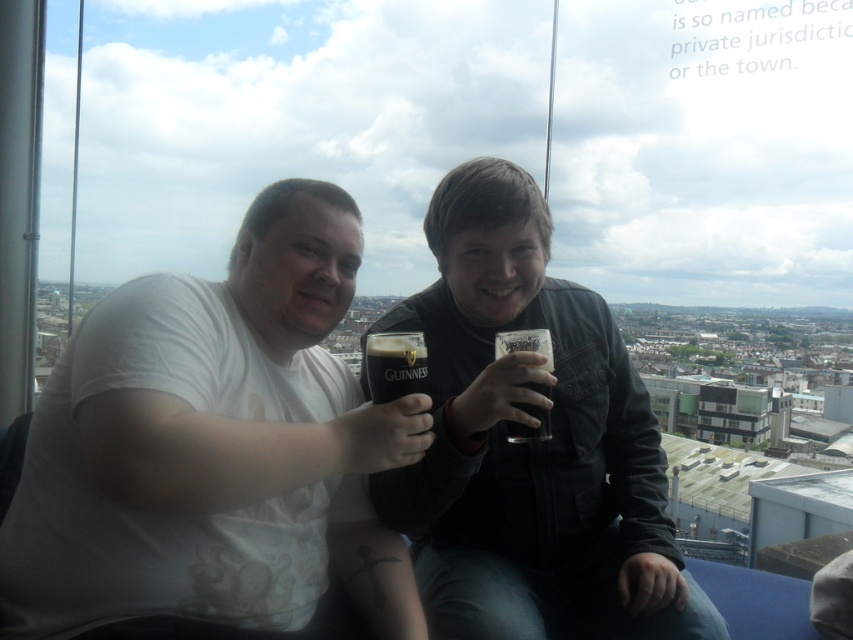
You are a photographer trying to capture both glasses in a single shot. Since the guinness dark glass at center and the dark brown glass at center are both at center, which glass will appear closer to the camera in the photo?

The guinness dark glass at center will appear closer to the camera because it is positioned in front of the dark brown glass at center according to the spatial arrangement.

You are standing in the room where the two people are sitting. You want to walk directly to the point that is closer to the window. Which point should you head towards, point [62,454] or point [422,378]?

Point [62,454] is in front of point [422,378], so you should head towards point [62,454] as it is closer to the window.

You are a photographer adjusting your camera settings to focus on two specific points in the scene. The first point is point (416, 332) and the second is point (514, 342). Which point should you focus on first to ensure both are in sharp focus?

You should focus on point (416, 332) first because it is closer to the camera than point (514, 342). By focusing on the closer point, the depth of field may help keep both points in focus.